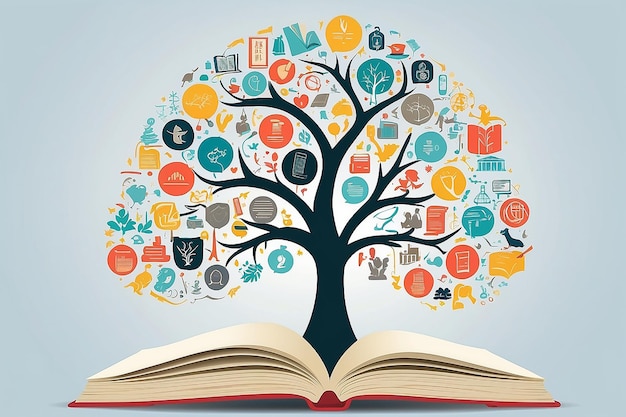
Locate an element on the screen. The height and width of the screenshot is (417, 626). book is located at coordinates (344, 393).